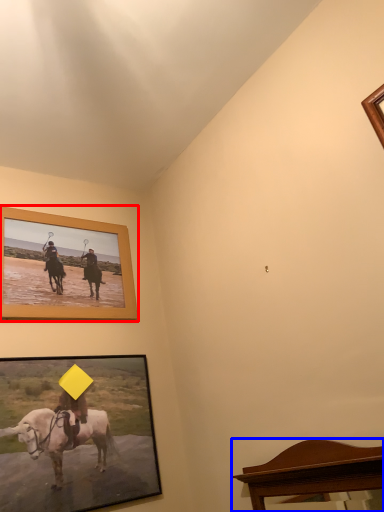
Question: Which object is closer to the camera taking this photo, picture frame (highlighted by a red box) or furniture (highlighted by a blue box)?

Choices:
 (A) picture frame
 (B) furniture

Answer: (B)